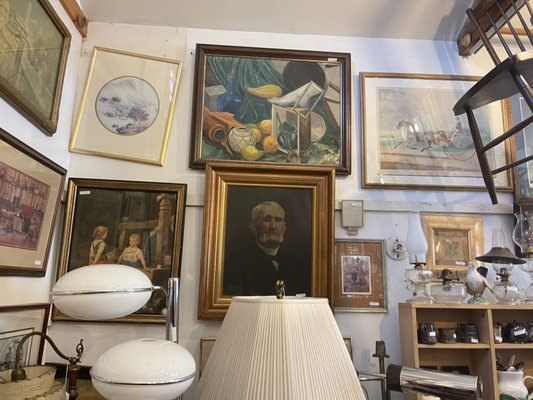
I want to click on white fabric lampshade, so click(302, 347).